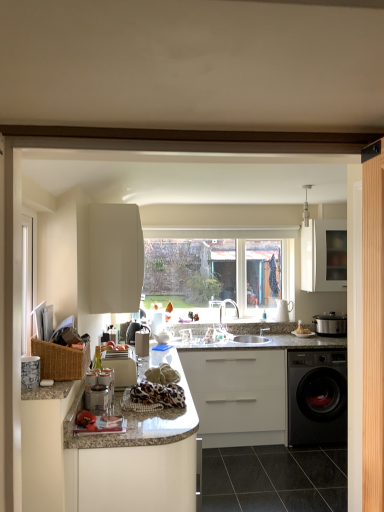
Question: Considering the positions of point (221, 326) and point (299, 390), is point (221, 326) closer or farther from the camera than point (299, 390)?

Choices:
 (A) closer
 (B) farther

Answer: (B)

Question: In terms of size, does satin nickel faucet at center appear bigger or smaller than black glossy washing machine at lower right?

Choices:
 (A) big
 (B) small

Answer: (B)

Question: Considering the real-world distances, which object is farthest from the white glossy cabinet at upper center, positioned as the 4th cabinetry in left-to-right order?

Choices:
 (A) white matte cabinet at upper center, the 4th cabinetry viewed from the right
 (B) white matte cabinet at center, which ranks as the 2th cabinetry in right-to-left order
 (C) matte silver slow cooker at right, acting as the 1th appliance starting from the back
 (D) light wood barn door at right
 (E) black glossy washing machine at lower right

Answer: (D)

Question: Which of these objects is positioned farthest from the woven brown basket at left?

Choices:
 (A) light wood barn door at right
 (B) white glossy cabinet at upper center, which is counted as the first cabinetry, starting from the right
 (C) satin nickel faucet at center
 (D) white matte cabinet at upper center, which is counted as the 1th cabinetry, starting from the left
 (E) matte silver slow cooker at right, arranged as the second appliance when viewed from the front

Answer: (B)